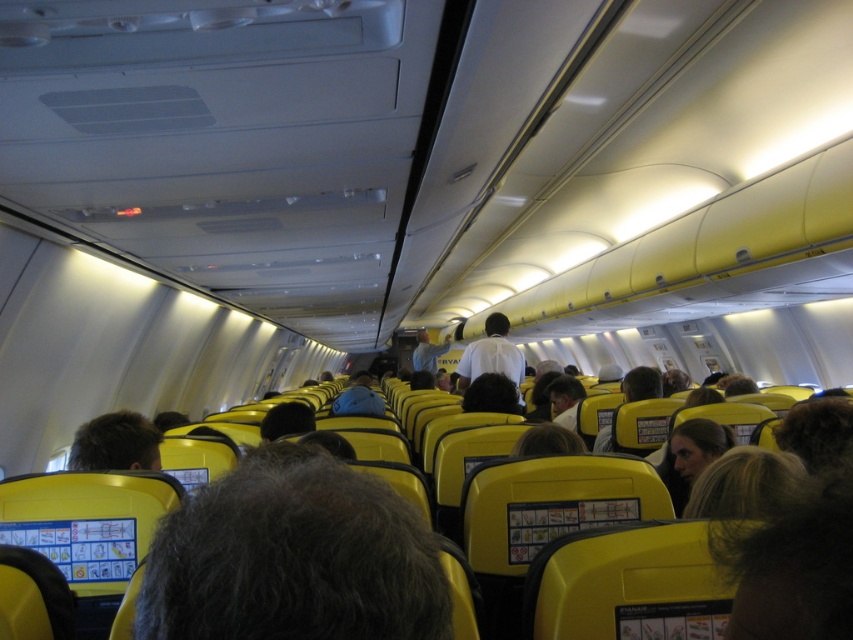
Question: Which of the following is the farthest from the observer?

Choices:
 (A) (457, 385)
 (B) (143, 435)

Answer: (A)

Question: Does dark brown hair at center appear over white shirt at center?

Choices:
 (A) no
 (B) yes

Answer: (B)

Question: Is dark brown hair at center closer to the viewer compared to white shirt at center?

Choices:
 (A) yes
 (B) no

Answer: (A)

Question: Is dark brown hair at center closer to camera compared to white shirt at center?

Choices:
 (A) no
 (B) yes

Answer: (B)

Question: Which point is farther to the camera?

Choices:
 (A) dark brown hair at center
 (B) white shirt at center

Answer: (B)